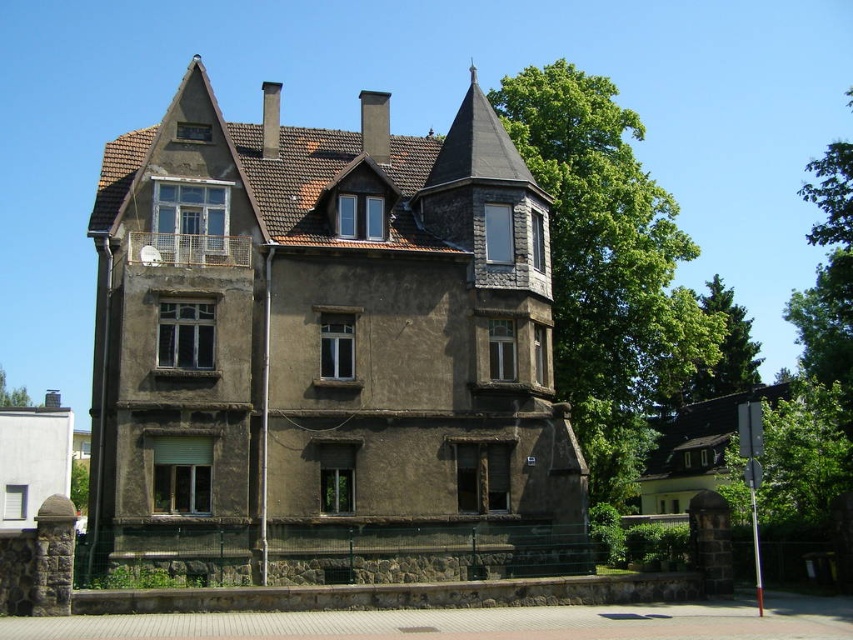
Question: Which point appears farthest from the camera in this image?

Choices:
 (A) (357, 515)
 (B) (28, 396)

Answer: (B)

Question: Which point is farther to the camera?

Choices:
 (A) green leafy tree at upper center
 (B) dark brown stone tower at center

Answer: (A)

Question: Is dark brown stone tower at center positioned at the back of green leafy tree at upper center?

Choices:
 (A) no
 (B) yes

Answer: (A)

Question: Is dark brown stone tower at center above green leafy tree at upper center?

Choices:
 (A) yes
 (B) no

Answer: (A)

Question: Is dark brown stone tower at center smaller than green leafy tree at upper center?

Choices:
 (A) no
 (B) yes

Answer: (A)

Question: Which of the following is the closest to the observer?

Choices:
 (A) green leafy tree at upper center
 (B) dark brown stone tower at center

Answer: (B)